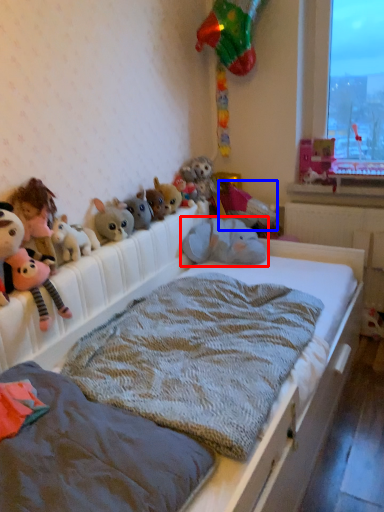
Question: Which point is further to the camera, toy (highlighted by a red box) or toy (highlighted by a blue box)?

Choices:
 (A) toy
 (B) toy

Answer: (B)